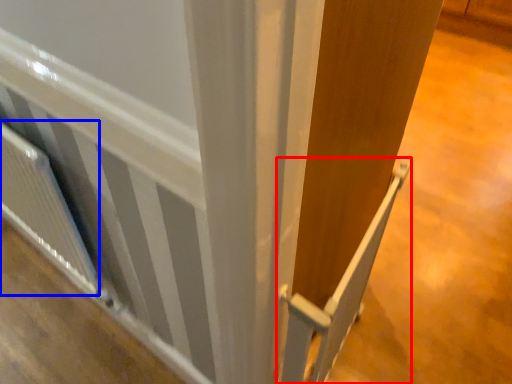
Question: Which object is further to the camera taking this photo, rail (highlighted by a red box) or radiator (highlighted by a blue box)?

Choices:
 (A) rail
 (B) radiator

Answer: (B)